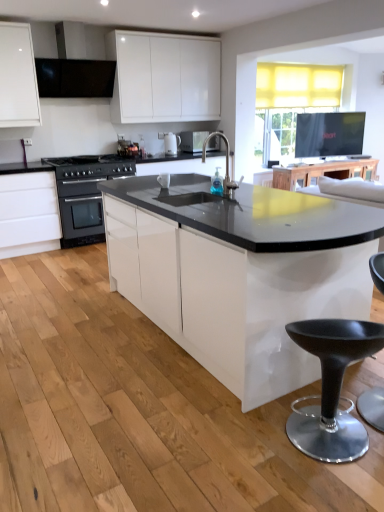
Question: From a real-world perspective, is black plastic swivel chair at lower right above or below black matte exhaust hood at upper left?

Choices:
 (A) above
 (B) below

Answer: (B)

Question: Considering the positions of black plastic swivel chair at lower right and black matte exhaust hood at upper left in the image, is black plastic swivel chair at lower right taller or shorter than black matte exhaust hood at upper left?

Choices:
 (A) short
 (B) tall

Answer: (B)

Question: Which object is positioned closest to the wooden table at upper center?

Choices:
 (A) black stainless steel oven at left
 (B) black plastic stool at lower right
 (C) black plastic swivel chair at lower right
 (D) matte black microwave at center
 (E) black matte exhaust hood at upper left

Answer: (D)

Question: Which object is the farthest from the wooden table at upper center?

Choices:
 (A) white glossy cabinet at left
 (B) white glossy coffee machine at center
 (C) black stainless steel oven at left
 (D) matte black microwave at center
 (E) black plastic swivel chair at lower right

Answer: (E)